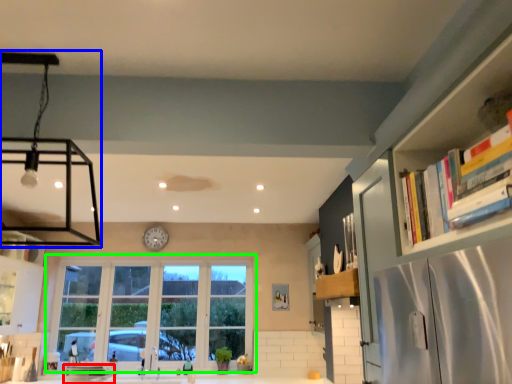
Question: Based on their relative distances, which object is nearer to appliance (highlighted by a red box)? Choose from light fixture (highlighted by a blue box) and window (highlighted by a green box).

Choices:
 (A) light fixture
 (B) window

Answer: (B)